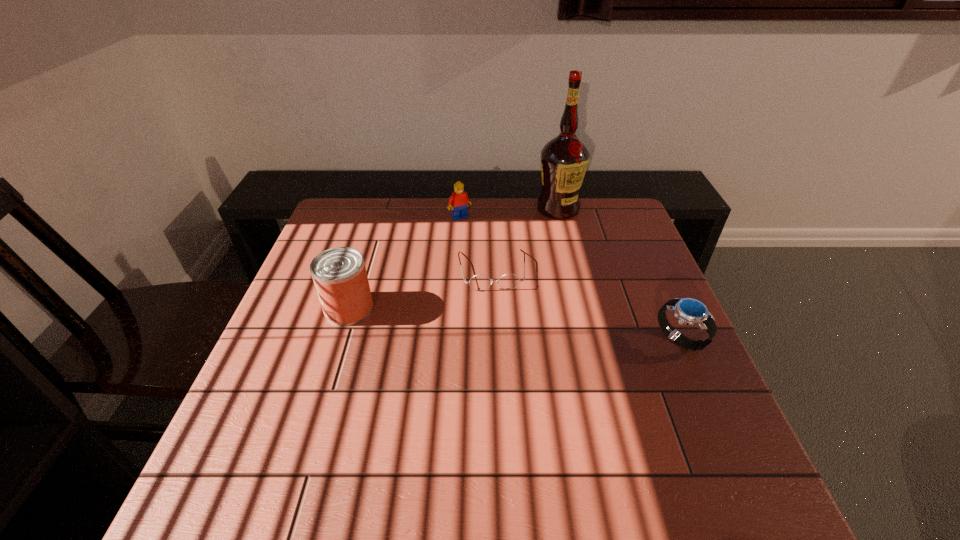
Identify the location of vacant space on the desktop that is between the fourth shortest object and the rightmost object and is positioned on the label of the tallest object. The width and height of the screenshot is (960, 540). (538, 326).

At what (x,y) coordinates should I click in order to perform the action: click on free space on the desktop that is between the second tallest object and the rightmost object and is positioned through the lenses of the spectacles. Please return your answer as a coordinate pair (x, y). Looking at the image, I should click on (497, 322).

Locate an element on the screen. vacant space on the desktop that is between the leftmost object and the watch and is positioned on the face of the third shortest object is located at coordinates (548, 327).